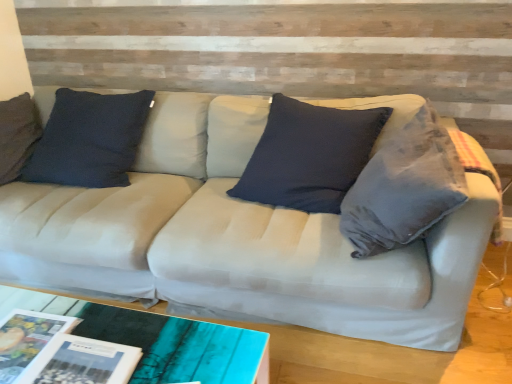
Question: Considering the positions of point (25, 352) and point (40, 365), is point (25, 352) closer or farther from the camera than point (40, 365)?

Choices:
 (A) farther
 (B) closer

Answer: (A)

Question: Looking at their shapes, would you say matte paper magazine at lower left, the 1th magazine when ordered from left to right, is wider or thinner than matte paper magazine at lower left, the 1th magazine in the right-to-left sequence?

Choices:
 (A) wide
 (B) thin

Answer: (B)

Question: Is matte paper magazine at lower left, the 1th magazine when ordered from left to right, taller or shorter than matte paper magazine at lower left, the 1th magazine in the right-to-left sequence?

Choices:
 (A) short
 (B) tall

Answer: (A)

Question: From a real-world perspective, is matte paper magazine at lower left, which is counted as the second magazine, starting from the left, physically located above or below matte paper magazine at lower left, the 1th magazine when ordered from left to right?

Choices:
 (A) below
 (B) above

Answer: (B)

Question: Visually, is matte paper magazine at lower left, which is counted as the second magazine, starting from the left, positioned to the left or to the right of matte paper magazine at lower left, which is the 2th magazine in right-to-left order?

Choices:
 (A) left
 (B) right

Answer: (B)

Question: From the image's perspective, is matte paper magazine at lower left, the 1th magazine in the right-to-left sequence, located above or below matte paper magazine at lower left, which is the 2th magazine in right-to-left order?

Choices:
 (A) above
 (B) below

Answer: (B)

Question: Is point (41, 377) positioned closer to the camera than point (28, 327)?

Choices:
 (A) closer
 (B) farther

Answer: (A)